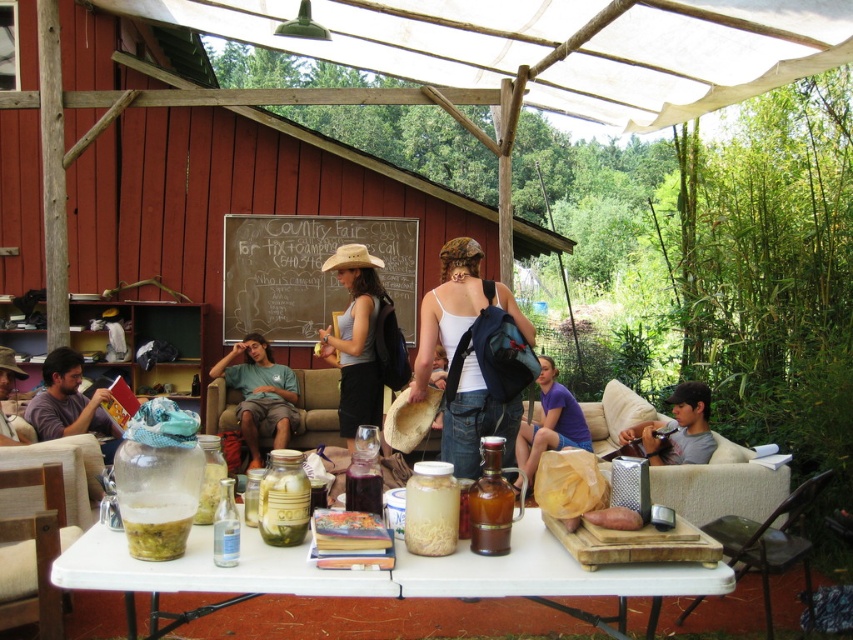
Between purple cotton shirt at center and painted wooden board at center, which one has less height?

With less height is painted wooden board at center.

Does point (518, 452) lie in front of point (331, 540)?

No, it is behind (331, 540).

Between point (573, 401) and point (328, 547), which one is positioned in front?

Point (328, 547) is more forward.

Image resolution: width=853 pixels, height=640 pixels. Identify the location of purple cotton shirt at center. (550, 422).

Who is positioned more to the left, chalkboard at center or green translucent jar at center?

Positioned to the left is chalkboard at center.

Can you confirm if chalkboard at center is taller than green translucent jar at center?

Correct, chalkboard at center is much taller as green translucent jar at center.

The height and width of the screenshot is (640, 853). Describe the element at coordinates (306, 273) in the screenshot. I see `chalkboard at center` at that location.

This screenshot has height=640, width=853. What are the coordinates of `chalkboard at center` in the screenshot? It's located at (306, 273).

Does point (357, 368) come farther from viewer compared to point (346, 524)?

Yes, it is behind point (346, 524).

Which of these two, matte gray tank top at center or painted wooden board at center, stands shorter?

painted wooden board at center is shorter.

Identify the location of matte gray tank top at center. The width and height of the screenshot is (853, 640). point(355,339).